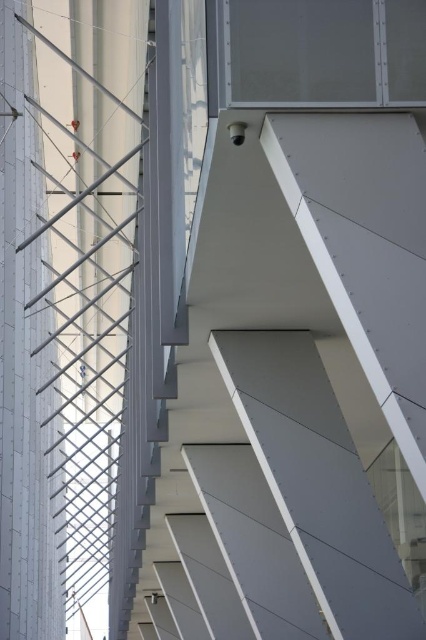
Question: Does white smooth stair at upper center appear on the left side of white matte pillar at left?

Choices:
 (A) yes
 (B) no

Answer: (B)

Question: Which object appears farthest from the camera in this image?

Choices:
 (A) white smooth stair at upper center
 (B) white matte pillar at left

Answer: (B)

Question: Is white smooth stair at upper center behind white matte pillar at left?

Choices:
 (A) yes
 (B) no

Answer: (B)

Question: Which object appears closest to the camera in this image?

Choices:
 (A) white smooth stair at upper center
 (B) white matte pillar at left

Answer: (A)

Question: Which of the following is the closest to the observer?

Choices:
 (A) (14, 339)
 (B) (344, 326)

Answer: (B)

Question: In this image, where is white smooth stair at upper center located relative to white matte pillar at left?

Choices:
 (A) below
 (B) above

Answer: (A)